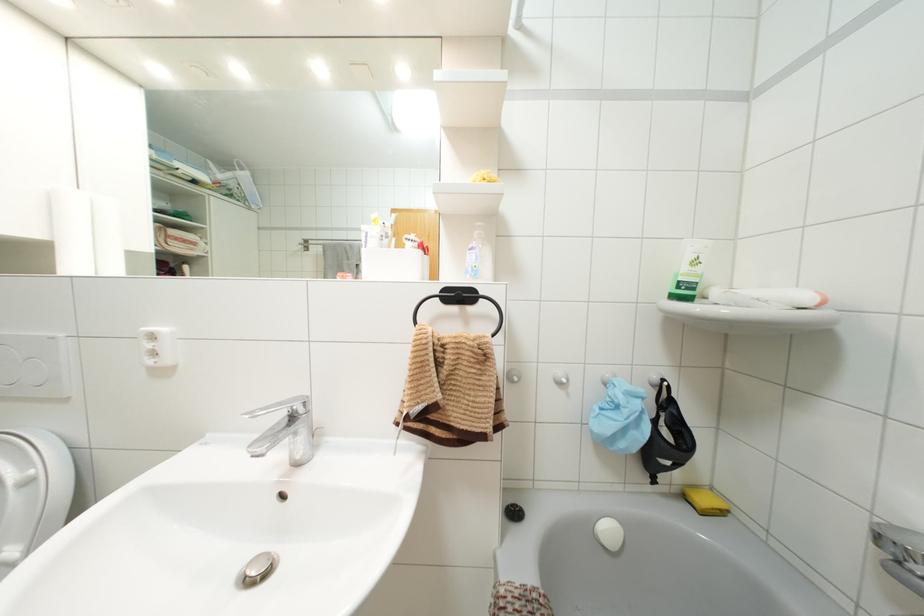
This screenshot has width=924, height=616. Describe the element at coordinates (561, 379) in the screenshot. I see `the white bathtub knob` at that location.